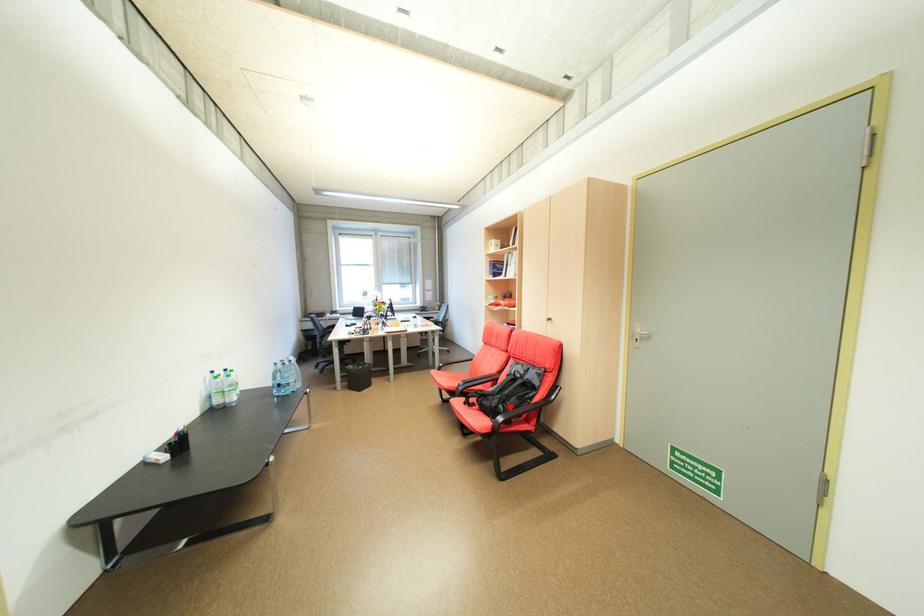
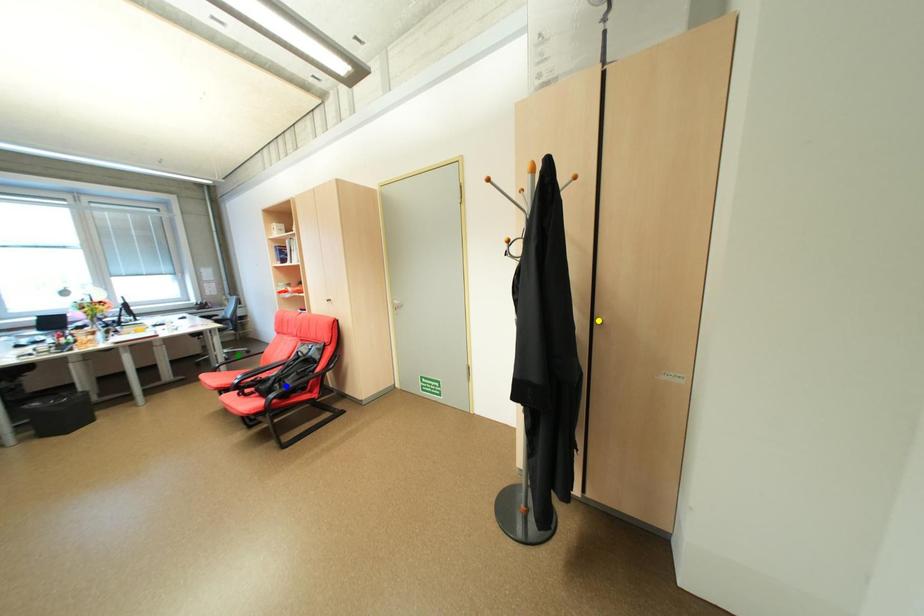
Question: I am providing you with two images of the same scene from different viewpoints. A red point is marked on the first image. You are given multiple points on the second image. Which spot in image 2 lines up with the point in image 1?

Choices:
 (A) blue point
 (B) green point
 (C) yellow point

Answer: (A)